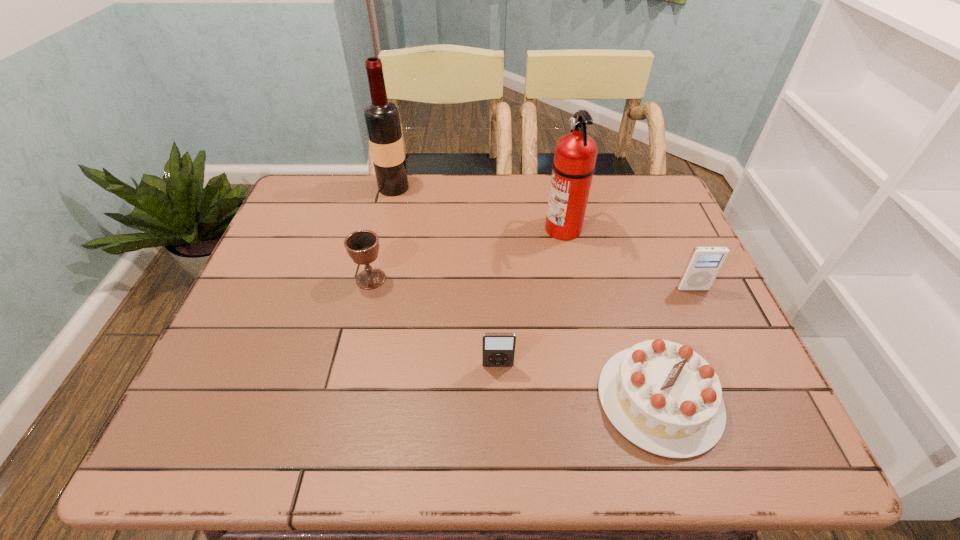
At what (x,y) coordinates should I click in order to perform the action: click on vacant space located 0.340m at the nozzle of the fire extinguisher. Please return your answer as a coordinate pair (x, y). Looking at the image, I should click on (424, 228).

In order to click on free region located 0.120m at the nozzle of the fire extinguisher in this screenshot , I will do `click(502, 228)`.

Locate an element on the screen. Image resolution: width=960 pixels, height=540 pixels. free space located on the front-facing side of the rightmost object is located at coordinates (731, 372).

The image size is (960, 540). I want to click on vacant space situated 0.050m on the front of the chalice, so click(x=365, y=306).

Image resolution: width=960 pixels, height=540 pixels. What are the coordinates of `vacant space situated 0.070m on the front-facing side of the third object from left to right` in the screenshot? It's located at (499, 397).

Find the location of a particular element. vacant space located 0.400m on the left of the birthday cake is located at coordinates (399, 399).

The height and width of the screenshot is (540, 960). In order to click on wine bottle located in the far edge section of the desktop in this screenshot , I will do `click(382, 118)`.

This screenshot has height=540, width=960. In order to click on fire extinguisher at the far edge in this screenshot , I will do `click(575, 155)`.

Image resolution: width=960 pixels, height=540 pixels. In order to click on object that is at the near edge in this screenshot , I will do `click(665, 398)`.

Locate an element on the screen. The width and height of the screenshot is (960, 540). iPod situated at the right edge is located at coordinates (704, 264).